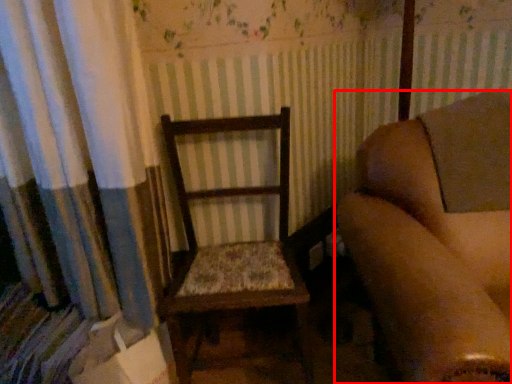
Question: Considering the relative positions of chair (annotated by the red box) and rocking chair in the image provided, where is chair (annotated by the red box) located with respect to the staircase?

Choices:
 (A) left
 (B) right

Answer: (B)